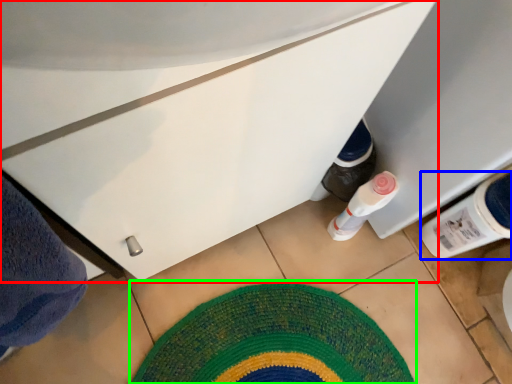
Question: Considering the real-world distances, which object is farthest from cabinetry (highlighted by a red box)? bottle (highlighted by a blue box) or mat (highlighted by a green box)?

Choices:
 (A) bottle
 (B) mat

Answer: (B)